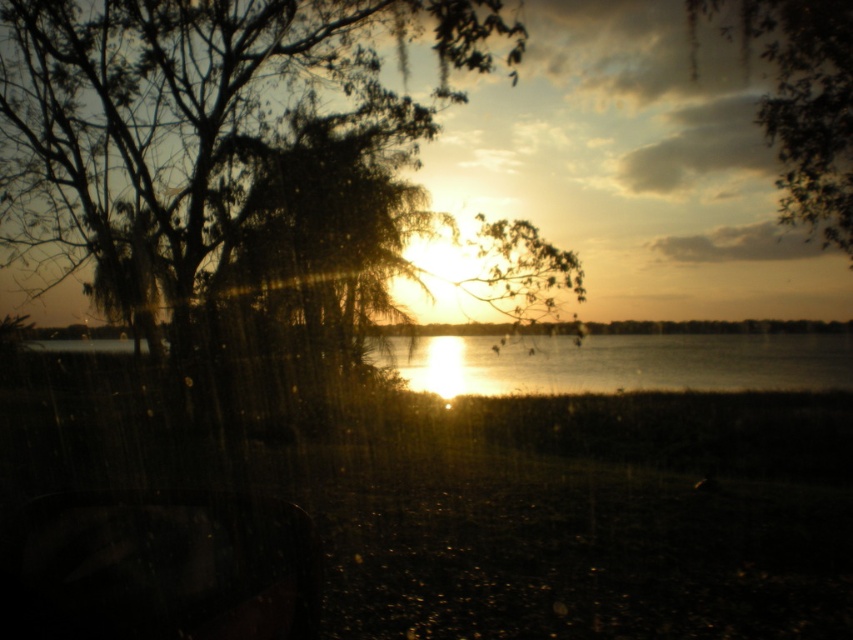
You are standing on the grassy area in front of the silhouetted trees. You want to take a photo of the sunset with both the glistening silver water at center and the green leafy tree at upper center in the frame. Which object should you position closer to the bottom of the photo to ensure both are visible?

You should position the glistening silver water at center closer to the bottom of the photo because it is shorter than the green leafy tree at upper center, allowing both to fit within the frame.